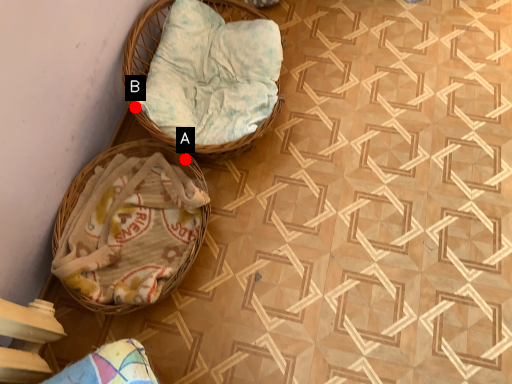
Question: Two points are circled on the image, labeled by A and B beside each circle. Which point is closer to the camera?

Choices:
 (A) A is closer
 (B) B is closer

Answer: (B)